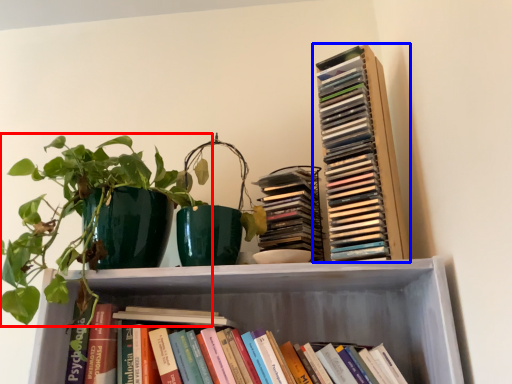
Question: Which object is further to the camera taking this photo, houseplant (highlighted by a red box) or book (highlighted by a blue box)?

Choices:
 (A) houseplant
 (B) book

Answer: (B)